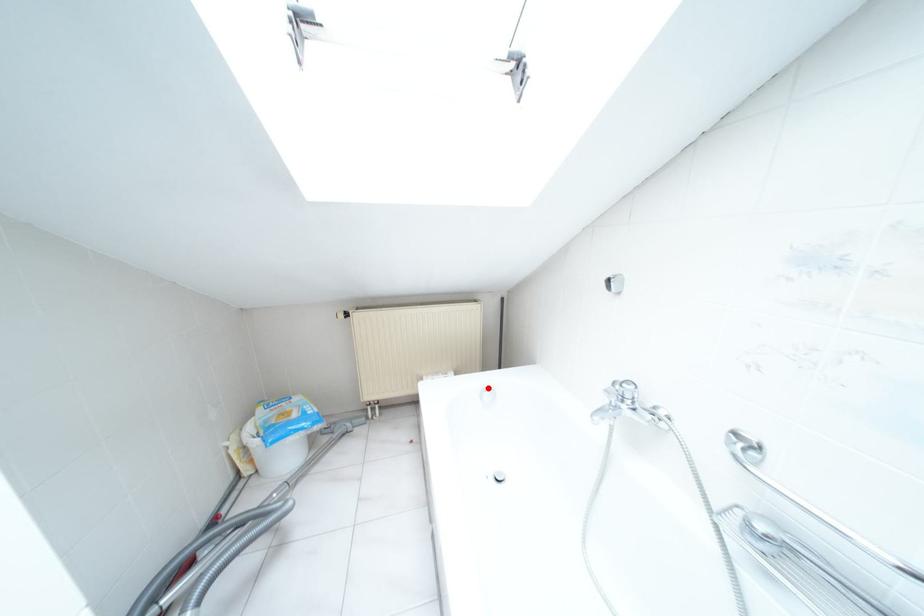
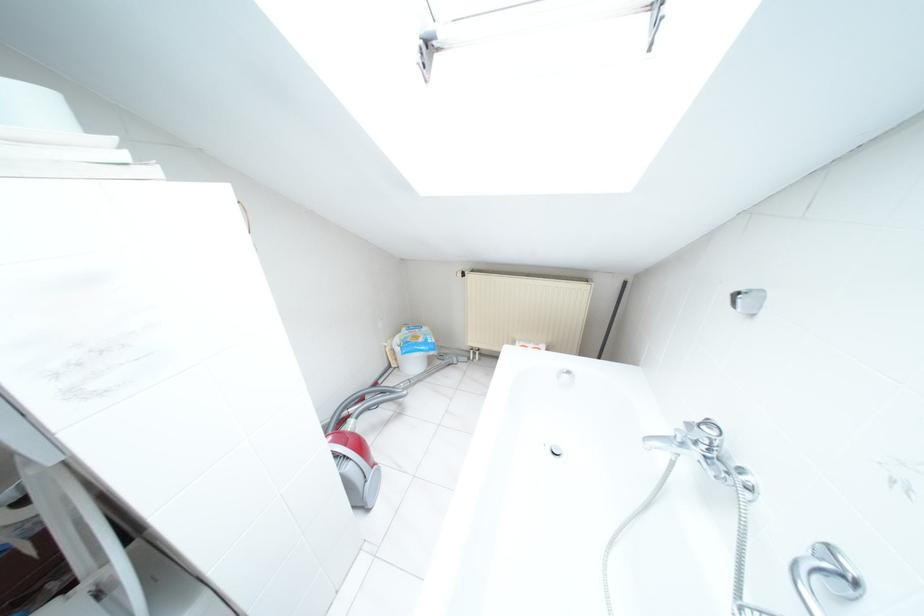
Where in the second image is the point corresponding to the highlighted location from the first image?

(567, 371)